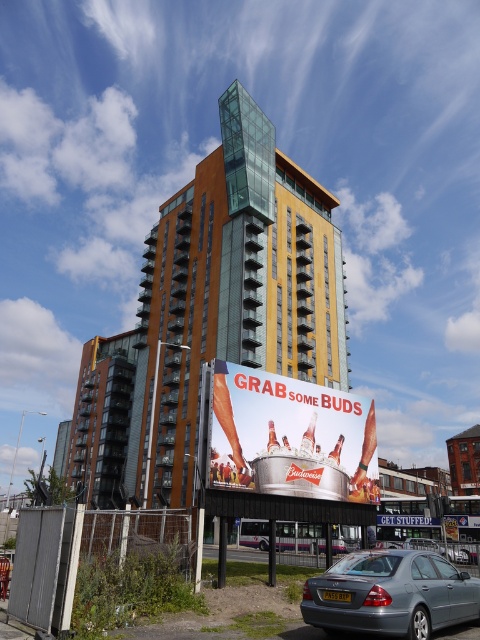
Question: Does metallic gray sedan at lower center have a larger size compared to silver metallic sedan at lower center?

Choices:
 (A) no
 (B) yes

Answer: (A)

Question: Is metallic silver beer at center below metallic gray sedan at lower center?

Choices:
 (A) yes
 (B) no

Answer: (B)

Question: Which point appears closest to the camera in this image?

Choices:
 (A) (450, 547)
 (B) (414, 544)

Answer: (A)

Question: Which point appears closest to the camera in this image?

Choices:
 (A) (408, 561)
 (B) (350, 484)
 (C) (434, 524)

Answer: (A)

Question: Which point appears farthest from the camera in this image?

Choices:
 (A) (374, 588)
 (B) (262, 472)
 (C) (469, 554)

Answer: (C)

Question: Considering the relative positions of white cardboard billboard at center and silver metallic sedan at lower center in the image provided, where is white cardboard billboard at center located with respect to silver metallic sedan at lower center?

Choices:
 (A) left
 (B) right

Answer: (A)